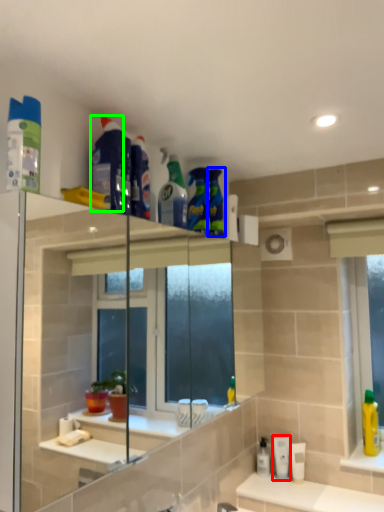
Question: Which object is the closest to the mouthwash (highlighted by a red box)? Choose among these: cleaning product (highlighted by a blue box) or cleaning product (highlighted by a green box).

Choices:
 (A) cleaning product
 (B) cleaning product

Answer: (A)